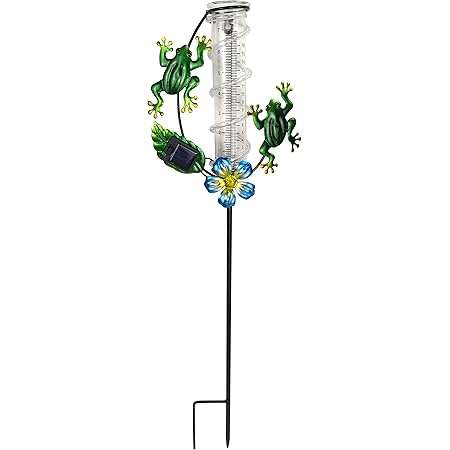
Identify the location of glass flower. (225, 183).